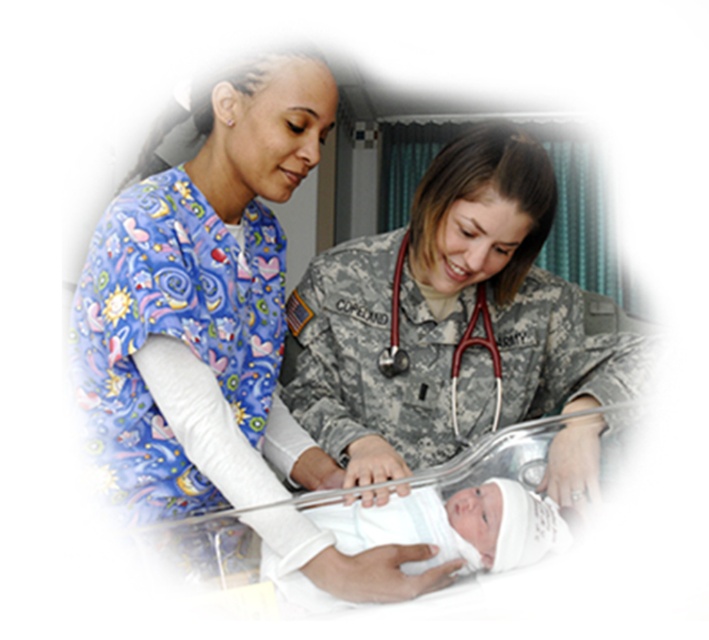
Question: Which object is farther from the camera taking this photo?

Choices:
 (A) printed cotton scrub top at left
 (B) camouflage uniform at center

Answer: (B)

Question: Does printed cotton scrub top at left have a smaller size compared to red rubber stethoscope at center?

Choices:
 (A) yes
 (B) no

Answer: (B)

Question: Does printed cotton scrub top at left appear on the left side of red rubber stethoscope at center?

Choices:
 (A) no
 (B) yes

Answer: (B)

Question: Which point is farther from the camera taking this photo?

Choices:
 (A) (398, 429)
 (B) (454, 413)

Answer: (A)

Question: Does printed cotton scrub top at left appear on the right side of red rubber stethoscope at center?

Choices:
 (A) no
 (B) yes

Answer: (A)

Question: Estimate the real-world distances between objects in this image. Which object is farther from the red rubber stethoscope at center?

Choices:
 (A) printed cotton scrub top at left
 (B) camouflage uniform at center

Answer: (A)